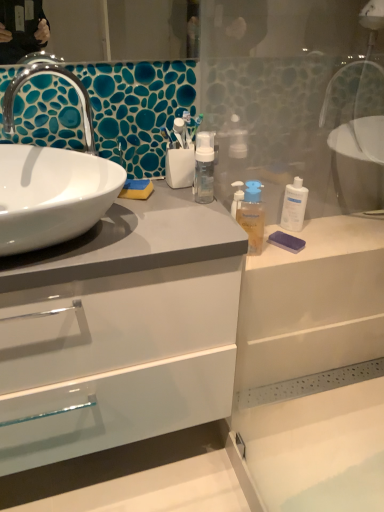
Question: Does white plastic bottle at right, the second mouthwash from the left, turn towards purple matte bar of soap at right?

Choices:
 (A) yes
 (B) no

Answer: (A)

Question: Does white plastic bottle at right, the first mouthwash in the right-to-left sequence, have a lesser height compared to purple matte bar of soap at right?

Choices:
 (A) no
 (B) yes

Answer: (A)

Question: Is white plastic bottle at right, marked as the second mouthwash in a front-to-back arrangement, not close to purple matte bar of soap at right?

Choices:
 (A) no
 (B) yes

Answer: (A)

Question: From the image's perspective, is white plastic bottle at right, the first mouthwash in the right-to-left sequence, located beneath purple matte bar of soap at right?

Choices:
 (A) yes
 (B) no

Answer: (B)

Question: Is purple matte bar of soap at right surrounded by white plastic bottle at right, the second mouthwash from the left?

Choices:
 (A) no
 (B) yes

Answer: (A)

Question: Is white plastic bottle at right, marked as the second mouthwash in a front-to-back arrangement, touching purple matte bar of soap at right?

Choices:
 (A) yes
 (B) no

Answer: (B)

Question: Is white plastic bottle at right, the first mouthwash in the right-to-left sequence, surrounded by purple matte bar of soap at right?

Choices:
 (A) yes
 (B) no

Answer: (B)

Question: Is purple matte bar of soap at right at the right side of white plastic bottle at right, marked as the second mouthwash in a front-to-back arrangement?

Choices:
 (A) no
 (B) yes

Answer: (A)

Question: Does purple matte bar of soap at right have a greater width compared to white plastic bottle at right, the second mouthwash from the left?

Choices:
 (A) no
 (B) yes

Answer: (B)

Question: From a real-world perspective, is purple matte bar of soap at right over white plastic bottle at right, marked as the second mouthwash in a front-to-back arrangement?

Choices:
 (A) yes
 (B) no

Answer: (B)

Question: Is purple matte bar of soap at right to the left of white plastic bottle at right, the second mouthwash from the left, from the viewer's perspective?

Choices:
 (A) yes
 (B) no

Answer: (A)

Question: Is purple matte bar of soap at right oriented away from white plastic bottle at right, the second mouthwash from the left?

Choices:
 (A) no
 (B) yes

Answer: (A)

Question: Is purple matte bar of soap at right wider than white glossy sink at left?

Choices:
 (A) yes
 (B) no

Answer: (B)